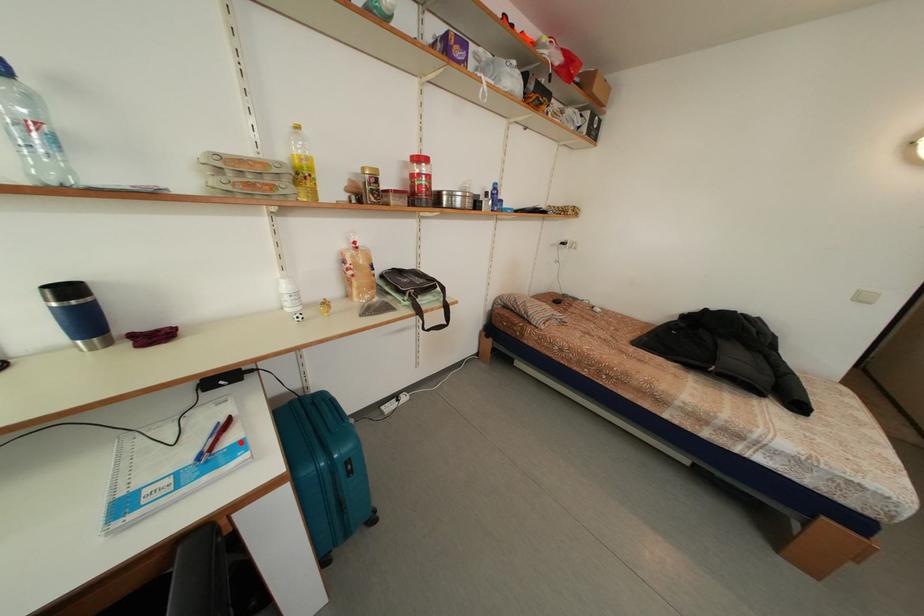
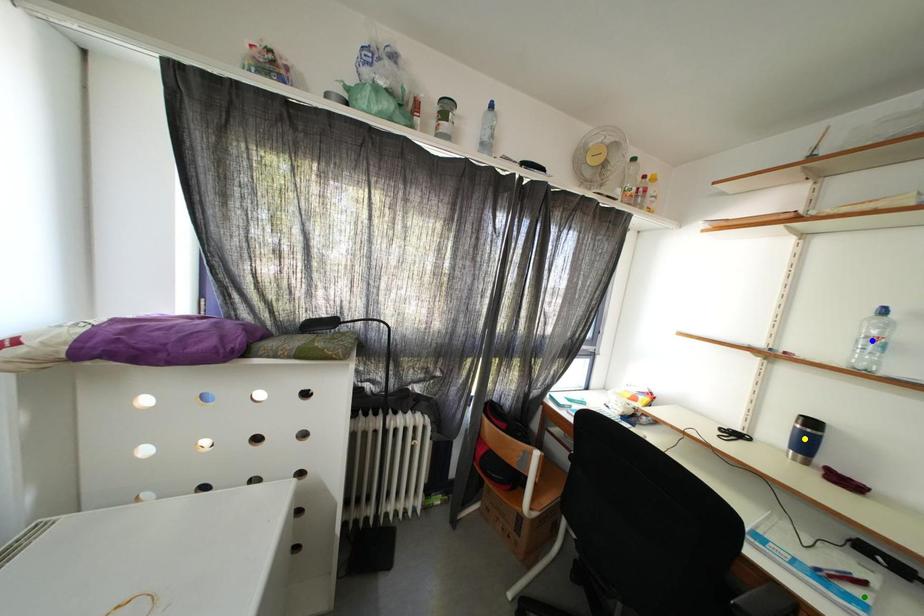
Question: I am providing you with two images of the same scene from different viewpoints. A red point is marked on the first image. You are given multiple points on the second image. In image 2, which mark is for the same physical point as the one in image 1?

Choices:
 (A) blue point
 (B) green point
 (C) yellow point

Answer: (B)